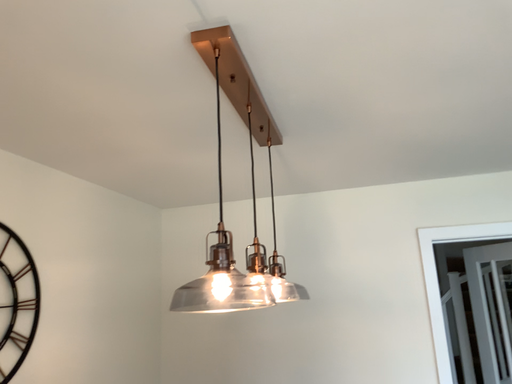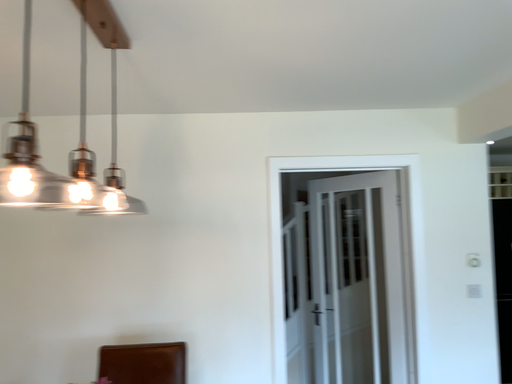
Question: Which way did the camera rotate in the video?

Choices:
 (A) rotated right
 (B) rotated left

Answer: (A)